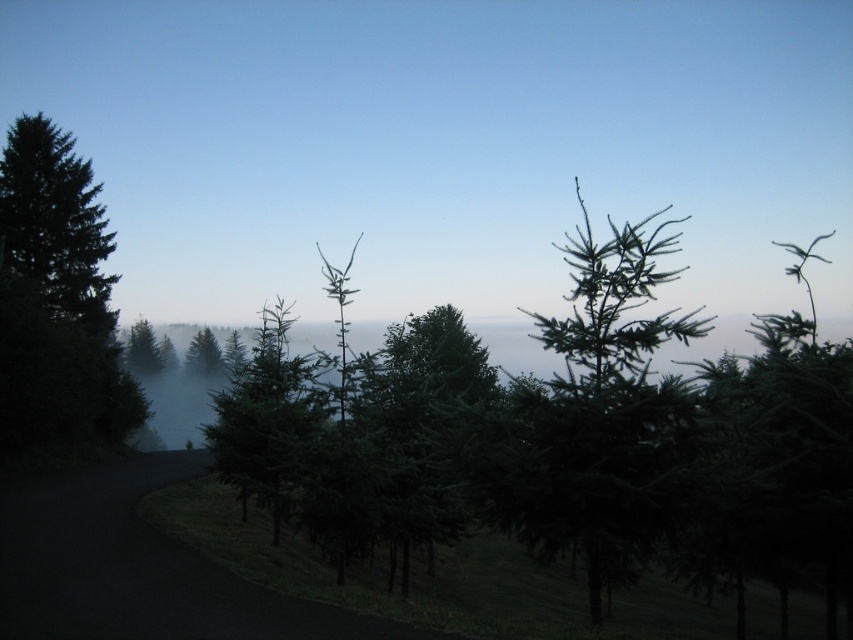
Question: Can you confirm if green matte trees at left is wider than green matte tree at left?

Choices:
 (A) no
 (B) yes

Answer: (B)

Question: Which point is closer to the camera?

Choices:
 (A) green matte trees at left
 (B) green matte tree at left

Answer: (B)

Question: Does green needle-like tree at center lie behind green matte tree at left?

Choices:
 (A) no
 (B) yes

Answer: (A)

Question: Estimate the real-world distances between objects in this image. Which object is closer to the green needle-like tree at center?

Choices:
 (A) green matte tree at center
 (B) green matte tree at left

Answer: (A)

Question: Is the position of green needle-like tree at center more distant than that of green matte tree at left?

Choices:
 (A) yes
 (B) no

Answer: (B)

Question: Which point is closer to the camera?

Choices:
 (A) (239, 388)
 (B) (28, 138)

Answer: (A)